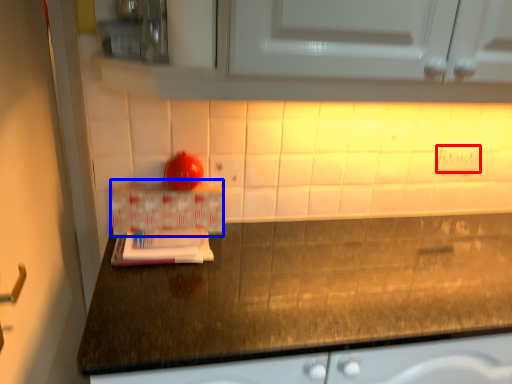
Question: Which object is closer to the camera taking this photo, electric outlet (highlighted by a red box) or box (highlighted by a blue box)?

Choices:
 (A) electric outlet
 (B) box

Answer: (B)